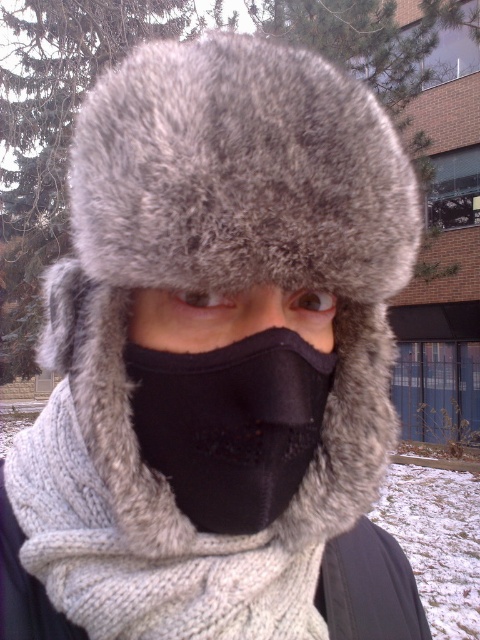
Question: Which object appears closest to the camera in this image?

Choices:
 (A) black fleece mask at center
 (B) black matte nose at center

Answer: (B)

Question: Is black fleece mask at center bigger than black matte nose at center?

Choices:
 (A) no
 (B) yes

Answer: (B)

Question: Is black fleece mask at center positioned behind black matte nose at center?

Choices:
 (A) no
 (B) yes

Answer: (B)

Question: Is black fleece mask at center smaller than black matte nose at center?

Choices:
 (A) yes
 (B) no

Answer: (B)

Question: Which point is closer to the camera?

Choices:
 (A) black fleece mask at center
 (B) black matte nose at center

Answer: (B)